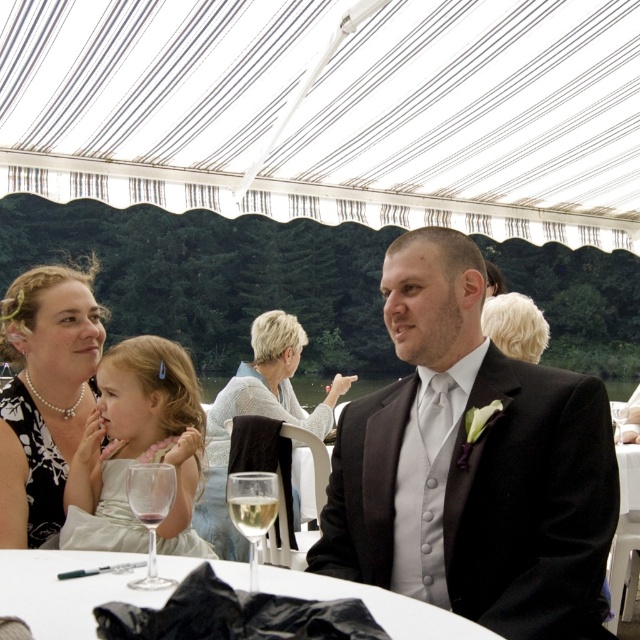
Question: Which object is positioned closest to the matte black suit at center?

Choices:
 (A) clear glass wine at lower center
 (B) clear glass wine glass at lower center

Answer: (B)

Question: Among these objects, which one is farthest from the camera?

Choices:
 (A) white satin dress at left
 (B) clear glass wine at lower center
 (C) white glossy table at center

Answer: (A)

Question: Which object appears closest to the camera in this image?

Choices:
 (A) clear glass wine glass at lower center
 (B) light gray knit sweater at center
 (C) clear glass wine at lower center

Answer: (A)

Question: Considering the relative positions of clear glass wine glass at lower left and clear glass wine at table front in the image provided, where is clear glass wine glass at lower left located with respect to clear glass wine at table front?

Choices:
 (A) above
 (B) below

Answer: (B)

Question: Does matte black suit at center appear on the right side of white satin dress at left?

Choices:
 (A) yes
 (B) no

Answer: (A)

Question: Is black satin suit at center positioned at the back of clear glass wine glass at lower center?

Choices:
 (A) yes
 (B) no

Answer: (A)